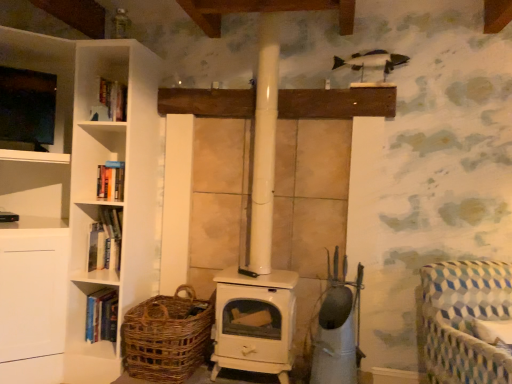
Question: Is hardcover book at left, which appears as the first book when viewed from the top, turned away from hardcover book at left, which is counted as the 2th book, starting from the top?

Choices:
 (A) no
 (B) yes

Answer: (A)

Question: Is hardcover book at left, the 2th book when ordered from bottom to top, next to hardcover book at left, which is counted as the 2th book, starting from the top?

Choices:
 (A) no
 (B) yes

Answer: (A)

Question: Would you consider hardcover book at left, the 2th book when ordered from bottom to top, to be distant from hardcover book at left, which appears as the first book when ordered from the bottom?

Choices:
 (A) no
 (B) yes

Answer: (A)

Question: Considering the relative sizes of hardcover book at left, the 2th book when ordered from bottom to top, and hardcover book at left, which is counted as the 2th book, starting from the top, in the image provided, is hardcover book at left, the 2th book when ordered from bottom to top, wider than hardcover book at left, which is counted as the 2th book, starting from the top,?

Choices:
 (A) no
 (B) yes

Answer: (A)

Question: Is hardcover book at left, the 2th book when ordered from bottom to top, bigger than hardcover book at left, which appears as the first book when ordered from the bottom?

Choices:
 (A) no
 (B) yes

Answer: (A)

Question: From the image's perspective, is hardcover book at left, which appears as the first book when viewed from the top, located above hardcover book at left, which is counted as the 2th book, starting from the top?

Choices:
 (A) no
 (B) yes

Answer: (B)

Question: From the image's perspective, does blue and white checkered fabric rocking chair at lower right appear higher than woven brown basket at lower left?

Choices:
 (A) no
 (B) yes

Answer: (B)

Question: Considering the relative sizes of blue and white checkered fabric rocking chair at lower right and woven brown basket at lower left in the image provided, is blue and white checkered fabric rocking chair at lower right smaller than woven brown basket at lower left?

Choices:
 (A) yes
 (B) no

Answer: (B)

Question: From the image's perspective, is blue and white checkered fabric rocking chair at lower right beneath woven brown basket at lower left?

Choices:
 (A) no
 (B) yes

Answer: (A)

Question: Does blue and white checkered fabric rocking chair at lower right have a lesser width compared to woven brown basket at lower left?

Choices:
 (A) no
 (B) yes

Answer: (A)

Question: Does blue and white checkered fabric rocking chair at lower right have a greater width compared to woven brown basket at lower left?

Choices:
 (A) yes
 (B) no

Answer: (A)

Question: Is blue and white checkered fabric rocking chair at lower right shorter than woven brown basket at lower left?

Choices:
 (A) no
 (B) yes

Answer: (A)

Question: From a real-world perspective, is woven brown basket at lower left physically above hardcover book at left, which is counted as the 2th book, starting from the top?

Choices:
 (A) yes
 (B) no

Answer: (A)